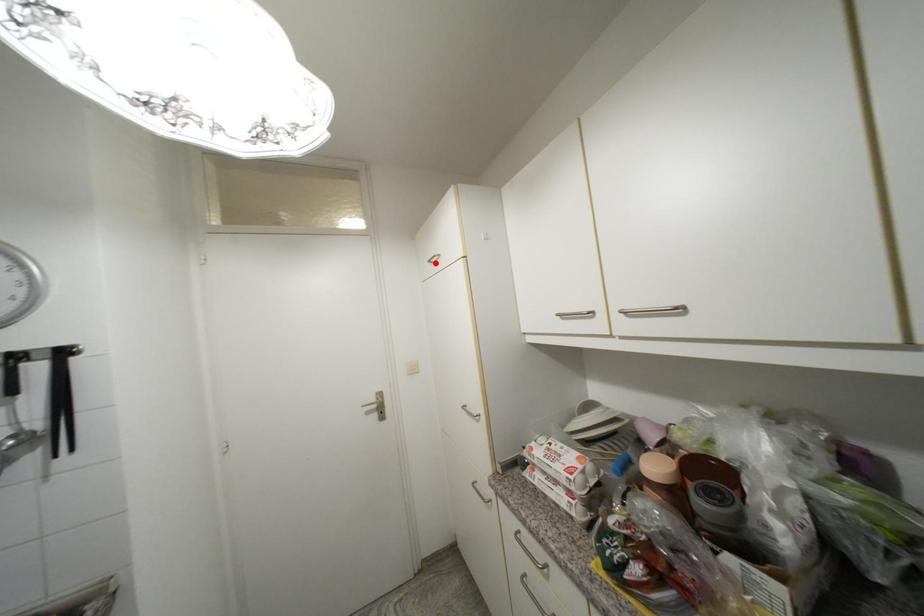
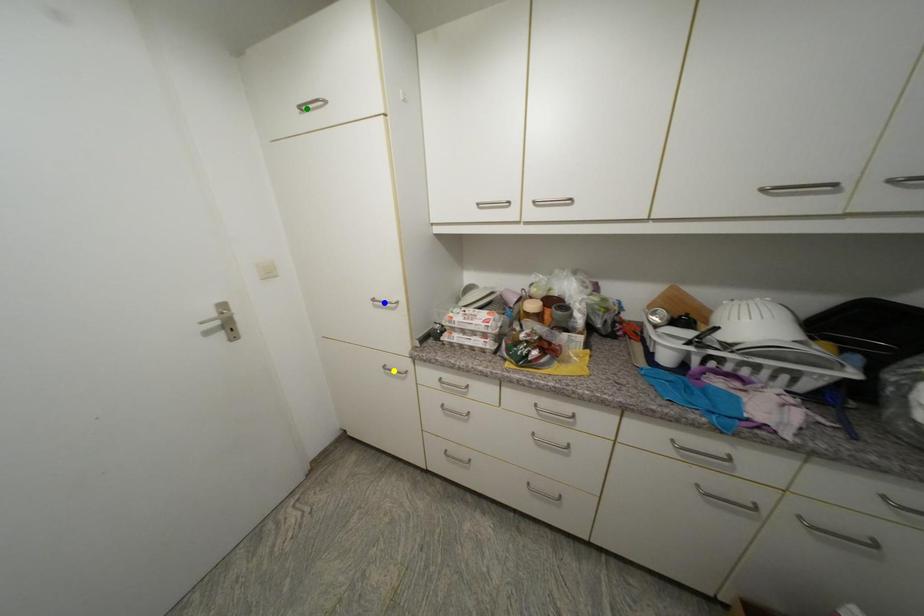
Question: I am providing you with two images of the same scene from different viewpoints. A red point is marked on the first image. You are given multiple points on the second image. In image 2, which mark is for the same physical point as the one in image 1?

Choices:
 (A) blue point
 (B) yellow point
 (C) green point

Answer: (C)